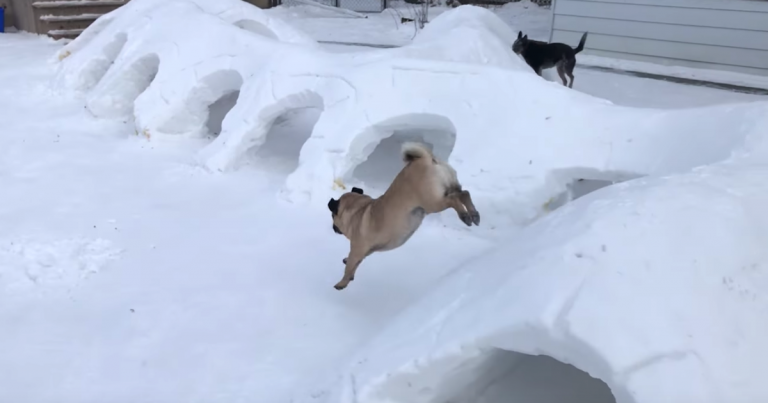
This screenshot has width=768, height=403. Identify the location of stairs. (65, 16).